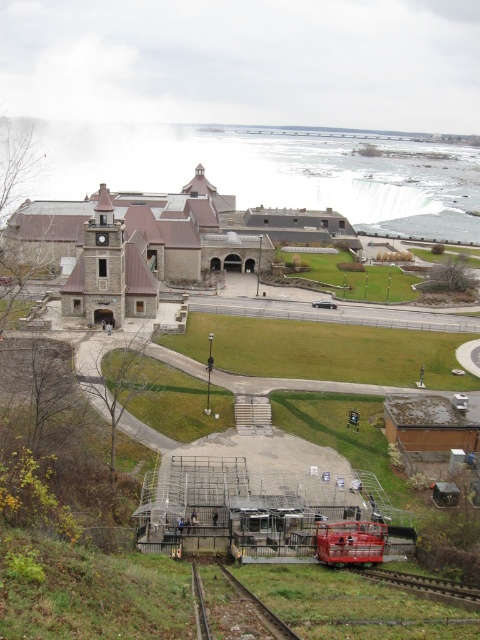
Is point (202, 602) farther from camera compared to point (368, 545)?

No, (202, 602) is closer to viewer.

Who is lower down, metallic rail at lower center or metallic red train at center?

metallic rail at lower center is below.

In order to click on metallic rail at lower center in this screenshot , I will do pos(231,608).

In the scene shown: Between metallic rail at lower center and metallic smooth train track at lower right, which one appears on the left side from the viewer's perspective?

From the viewer's perspective, metallic rail at lower center appears more on the left side.

Does metallic rail at lower center have a larger size compared to metallic smooth train track at lower right?

Yes, metallic rail at lower center is bigger than metallic smooth train track at lower right.

Locate an element on the screen. Image resolution: width=480 pixels, height=640 pixels. metallic rail at lower center is located at coordinates (231, 608).

Between metallic red train at center and metallic smooth train track at lower right, which one is positioned higher?

metallic red train at center is higher up.

Does point (356, 528) come in front of point (375, 576)?

No, (356, 528) is behind (375, 576).

At what (x,y) coordinates should I click in order to perform the action: click on metallic red train at center. Please return your answer as a coordinate pair (x, y). Looking at the image, I should click on 349,541.

Where is `metallic red train at center`? The height and width of the screenshot is (640, 480). metallic red train at center is located at coordinates (349, 541).